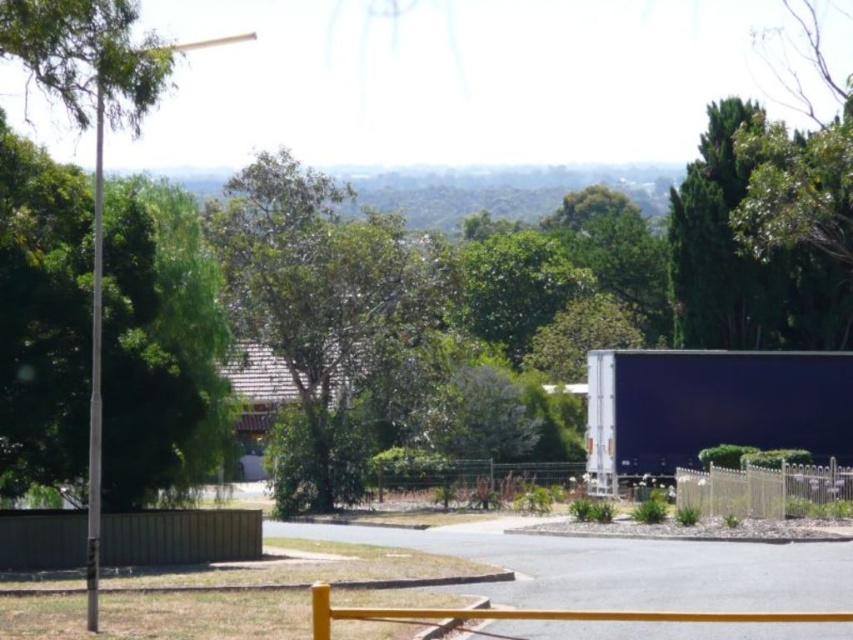
Between white metal fence at lower right and metallic wire fence at center, which one has more height?

With more height is white metal fence at lower right.

Between white metal fence at lower right and metallic wire fence at center, which one appears on the right side from the viewer's perspective?

From the viewer's perspective, white metal fence at lower right appears more on the right side.

Between point (792, 502) and point (374, 468), which one is positioned in front?

Point (792, 502)

Find the location of a particular element. The width and height of the screenshot is (853, 640). white metal fence at lower right is located at coordinates (762, 490).

You are a GUI agent. You are given a task and a screenshot of the screen. Output one action in this format:
    pyautogui.click(x=<x>, y=<y>)
    Task: Click on the brown wood fence at lower left
    
    Given the screenshot: What is the action you would take?
    pyautogui.click(x=178, y=536)

Who is positioned more to the left, brown wood fence at lower left or white metal fence at lower right?

Positioned to the left is brown wood fence at lower left.

Between point (209, 520) and point (718, 470), which one is positioned in front?

Point (209, 520)

You are a GUI agent. You are given a task and a screenshot of the screen. Output one action in this format:
    pyautogui.click(x=<x>, y=<y>)
    Task: Click on the brown wood fence at lower left
    The width and height of the screenshot is (853, 640).
    Given the screenshot: What is the action you would take?
    pyautogui.click(x=178, y=536)

Based on the photo, is green leafy tree at center wider than brown wood fence at lower left?

Indeed, green leafy tree at center has a greater width compared to brown wood fence at lower left.

Between green leafy tree at center and brown wood fence at lower left, which one has less height?

With less height is brown wood fence at lower left.

Between point (227, 284) and point (196, 516), which one is positioned behind?

Positioned behind is point (227, 284).

Locate an element on the screen. The width and height of the screenshot is (853, 640). green leafy tree at center is located at coordinates (328, 314).